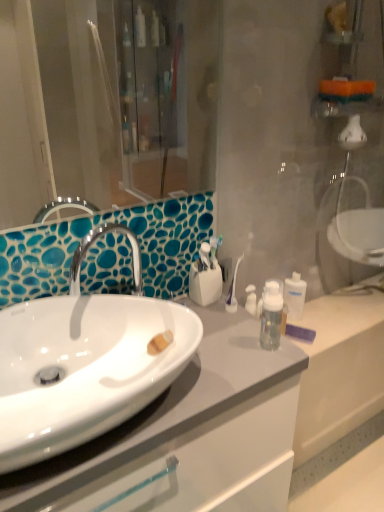
Question: Is clear plastic bottle at center-right inside the boundaries of white glossy sink at center, or outside?

Choices:
 (A) inside
 (B) outside

Answer: (B)

Question: Considering the positions of point (299, 274) and point (178, 306), is point (299, 274) closer or farther from the camera than point (178, 306)?

Choices:
 (A) closer
 (B) farther

Answer: (B)

Question: Based on their relative distances, which object is farther from the white glossy sink at center?

Choices:
 (A) white glossy cabinet at center
 (B) clear plastic bottle at center-right

Answer: (B)

Question: Based on their relative distances, which object is farther from the clear plastic bottle at center-right?

Choices:
 (A) white glossy sink at center
 (B) white glossy cabinet at center

Answer: (A)